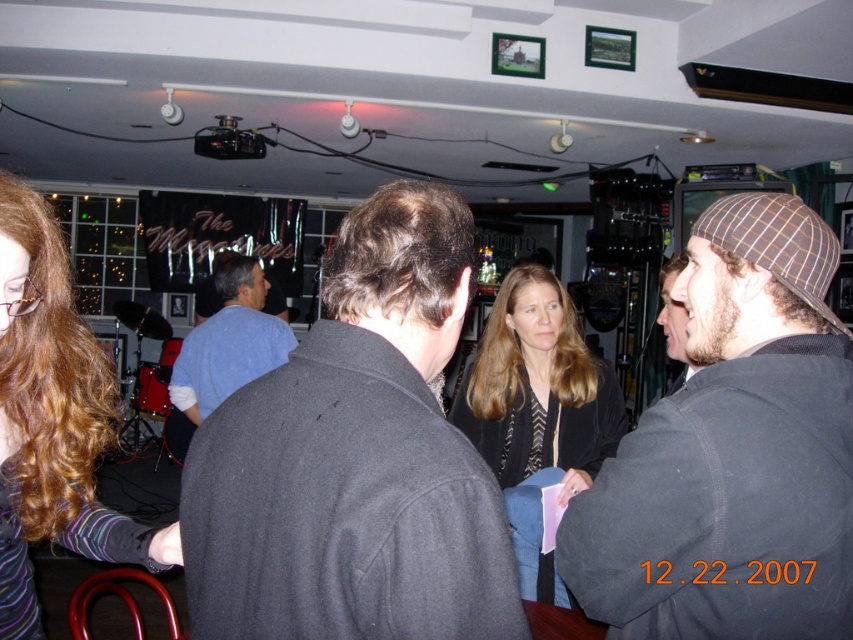
You are at a social event and want to approach the shiny brown hair at lower left without getting too close to the dark gray wool coat at center. Which direction should you move relative to the coat?

The dark gray wool coat at center is on the right side of the shiny brown hair at lower left. To approach the shiny brown hair at lower left without getting close to the coat, you should move to the left side of the dark gray wool coat at center.